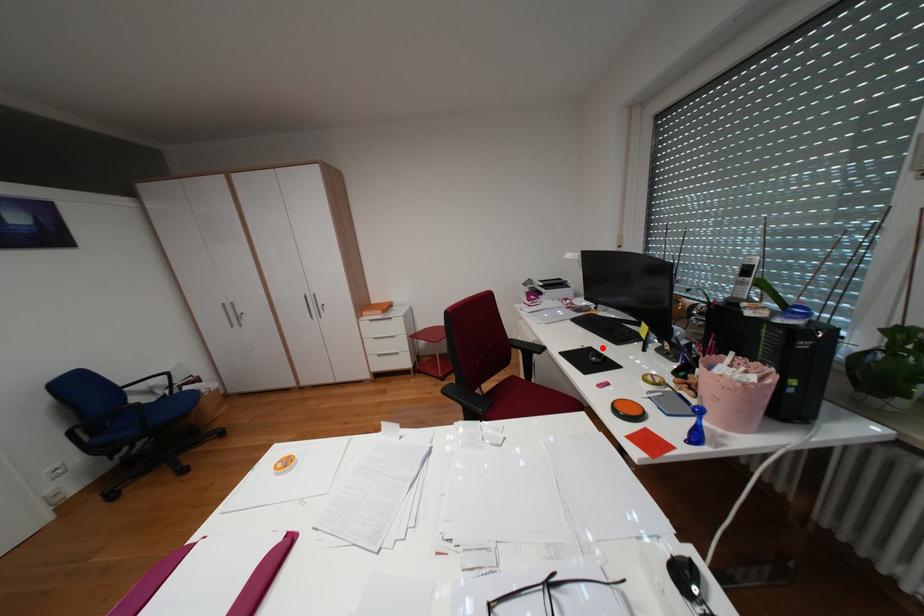
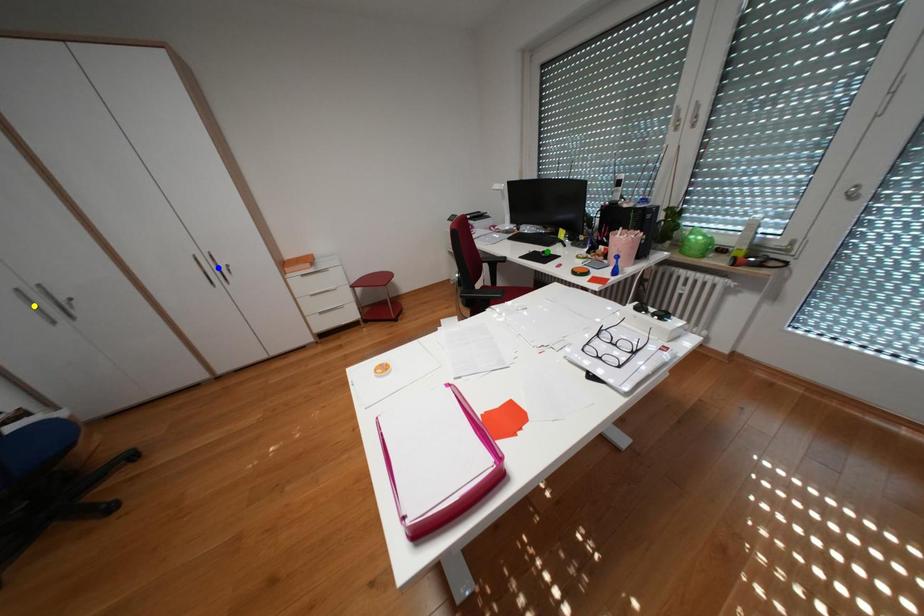
Question: I am providing you with two images of the same scene from different viewpoints. A red point is marked on the first image. You are given multiple points on the second image. Which point in image 2 represents the same 3d spot as the red point in image 1?

Choices:
 (A) blue point
 (B) green point
 (C) yellow point

Answer: (B)